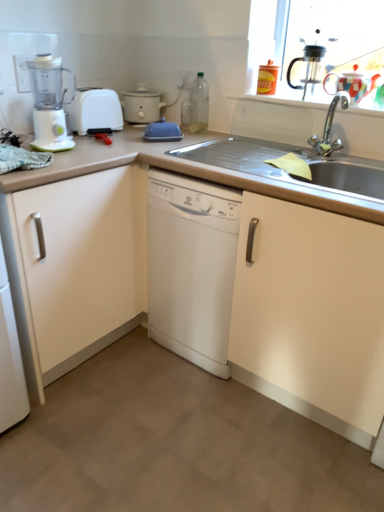
Question: Is white matte slow cooker at upper left bigger than matte white cabinet at left?

Choices:
 (A) yes
 (B) no

Answer: (B)

Question: From the image's perspective, is white matte slow cooker at upper left on matte white cabinet at left?

Choices:
 (A) yes
 (B) no

Answer: (A)

Question: From a real-world perspective, does white matte slow cooker at upper left stand above matte white cabinet at left?

Choices:
 (A) no
 (B) yes

Answer: (B)

Question: Considering the relative positions of white matte slow cooker at upper left and matte white cabinet at left in the image provided, is white matte slow cooker at upper left to the left of matte white cabinet at left from the viewer's perspective?

Choices:
 (A) no
 (B) yes

Answer: (A)

Question: Considering the relative sizes of white matte slow cooker at upper left and matte white cabinet at left in the image provided, is white matte slow cooker at upper left thinner than matte white cabinet at left?

Choices:
 (A) no
 (B) yes

Answer: (B)

Question: Considering the positions of white plastic toaster at left and white matte slow cooker at upper left in the image, is white plastic toaster at left wider or thinner than white matte slow cooker at upper left?

Choices:
 (A) thin
 (B) wide

Answer: (A)

Question: Is white plastic toaster at left situated inside white matte slow cooker at upper left or outside?

Choices:
 (A) outside
 (B) inside

Answer: (A)

Question: Is point (89, 91) closer or farther from the camera than point (137, 86)?

Choices:
 (A) farther
 (B) closer

Answer: (B)

Question: Considering their positions, is white plastic toaster at left located in front of or behind white matte slow cooker at upper left?

Choices:
 (A) front
 (B) behind

Answer: (A)

Question: Is multicolored ceramic tea pot at upper right bigger or smaller than white matte slow cooker at upper left?

Choices:
 (A) small
 (B) big

Answer: (A)

Question: In terms of height, does multicolored ceramic tea pot at upper right look taller or shorter compared to white matte slow cooker at upper left?

Choices:
 (A) short
 (B) tall

Answer: (A)

Question: Considering the relative positions of multicolored ceramic tea pot at upper right and white matte slow cooker at upper left in the image provided, is multicolored ceramic tea pot at upper right to the left or to the right of white matte slow cooker at upper left?

Choices:
 (A) right
 (B) left

Answer: (A)

Question: Considering the positions of point (327, 88) and point (129, 104), is point (327, 88) closer or farther from the camera than point (129, 104)?

Choices:
 (A) farther
 (B) closer

Answer: (B)

Question: From a real-world perspective, is black plastic coffee machine at upper right physically located above or below blue rubber dish drainer at center?

Choices:
 (A) below
 (B) above

Answer: (B)

Question: From their relative heights in the image, would you say black plastic coffee machine at upper right is taller or shorter than blue rubber dish drainer at center?

Choices:
 (A) short
 (B) tall

Answer: (B)